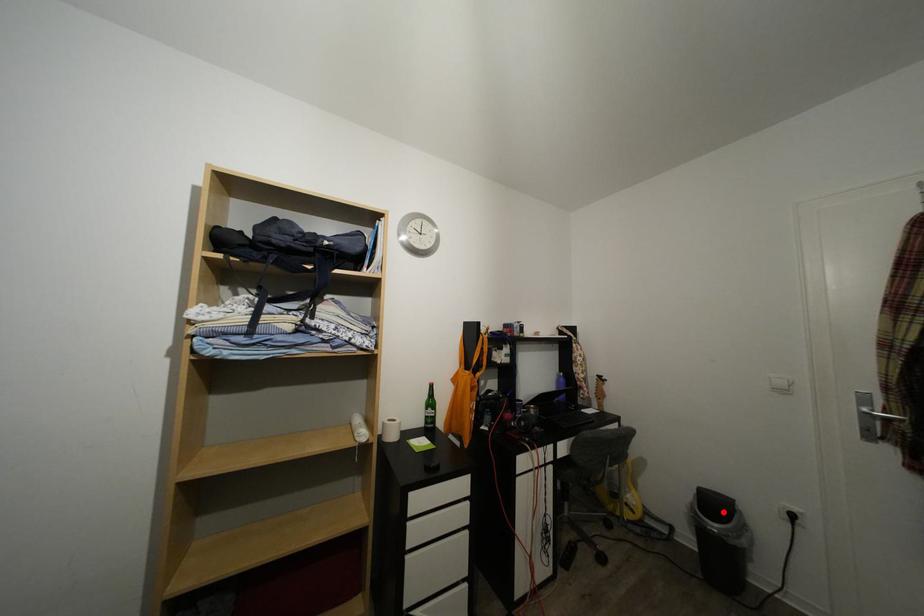
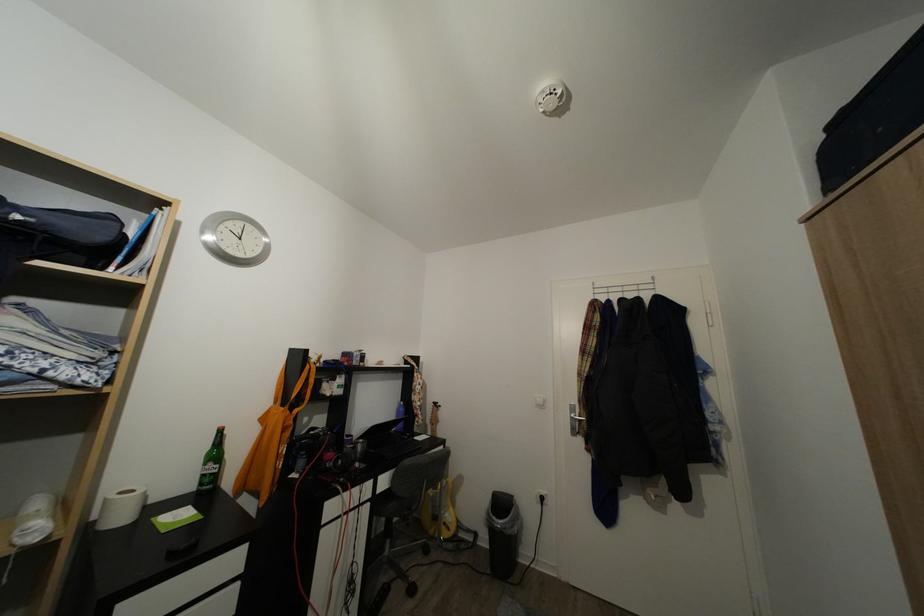
Question: I am providing you with two images of the same scene from different viewpoints. In image1, a red point is highlighted. Considering the same 3D point in image2, which of the following is correct?

Choices:
 (A) It is closer
 (B) It is farther

Answer: (B)